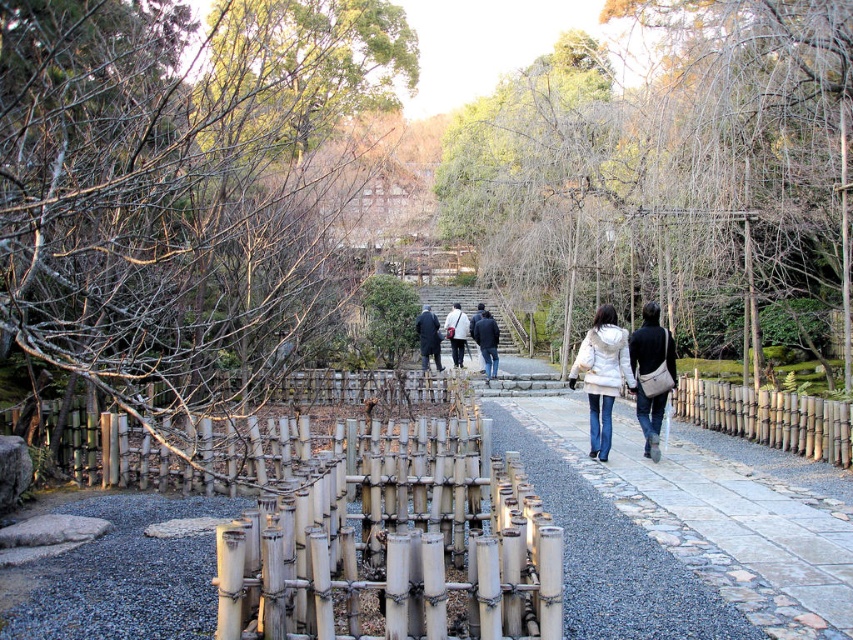
You are standing at the entrance of the garden and notice a bare branches at center and a matte black jacket at center. Which object appears bigger in the scene?

The bare branches at center is larger in size than the matte black jacket at center, so the bare branches at center appears bigger in the scene.

You are standing on the gravel pathway in the Japanese garden and notice two objects at the center of the scene. Which object is bigger between the bare branches at center and the dark blue jeans at center?

The bare branches at center has a larger size compared to the dark blue jeans at center.